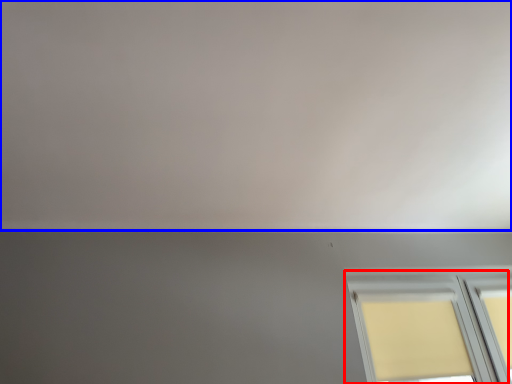
Question: Which of the following is the closest to the observer, window (highlighted by a red box) or backdrop (highlighted by a blue box)?

Choices:
 (A) window
 (B) backdrop

Answer: (B)